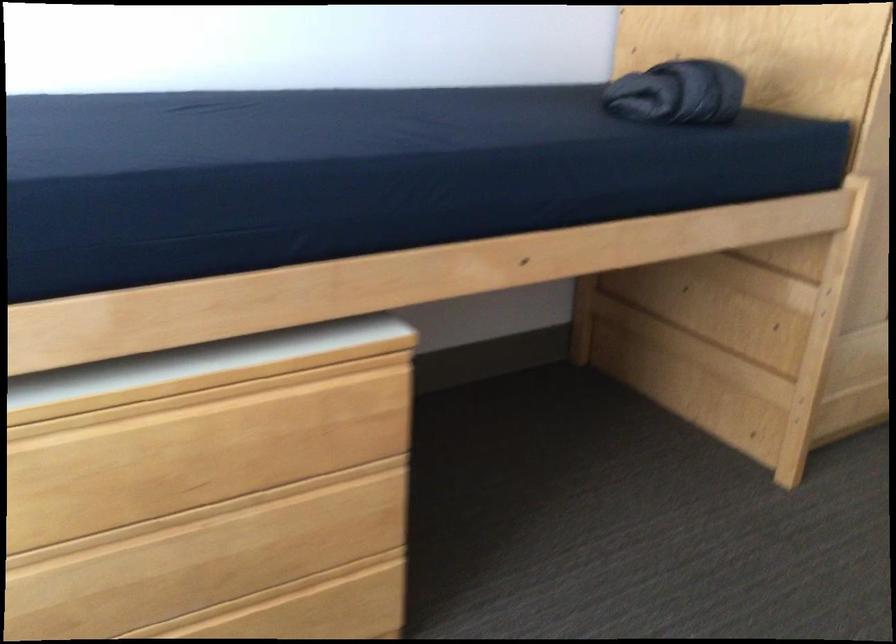
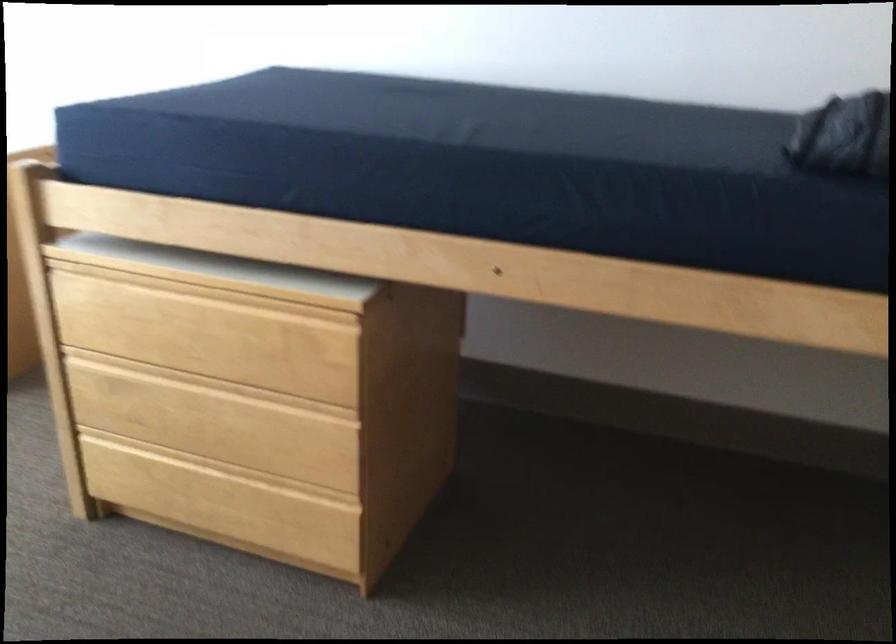
Question: I am providing you with two images of the same scene from different viewpoints. After the viewpoint changes to image2, which objects are now occluded?

Choices:
 (A) bottom drawer handle
 (B) top drawer handle
 (C) middle drawer handle
 (D) none of these

Answer: (D)